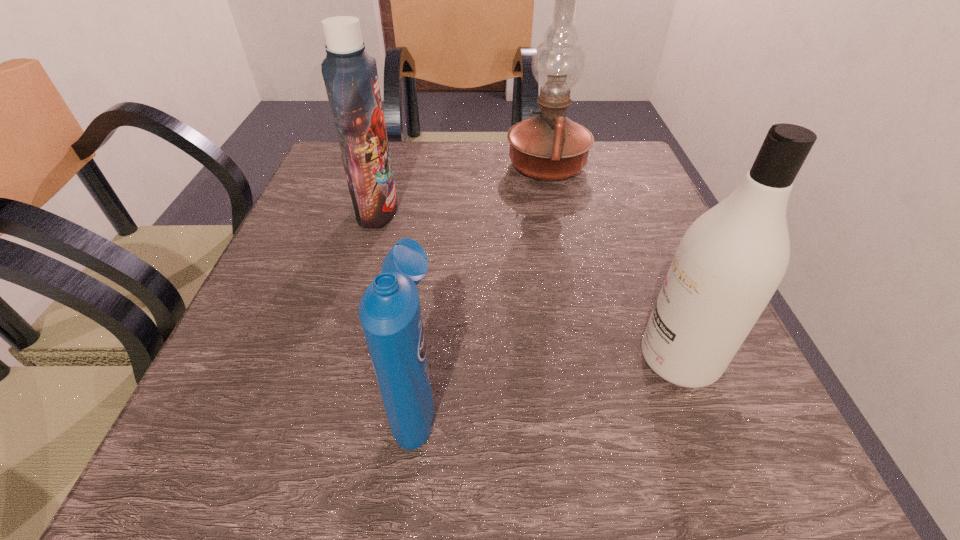
The image size is (960, 540). In order to click on free spot between the rightmost shampoo and the farthest object in this screenshot , I will do `click(612, 262)`.

Locate an element on the screen. The image size is (960, 540). free space between the rightmost shampoo and the oil lamp is located at coordinates (612, 262).

Image resolution: width=960 pixels, height=540 pixels. I want to click on vacant point located between the second object from left to right and the rightmost shampoo, so click(547, 379).

Find the location of `free point between the shortest object and the farthest object`. free point between the shortest object and the farthest object is located at coordinates (482, 282).

Select which object appears as the third closest to the farthest shampoo. Please provide its 2D coordinates. Your answer should be formatted as a tuple, i.e. [(x, y)], where the tuple contains the x and y coordinates of a point satisfying the conditions above.

[(729, 263)]

Point out which object is positioned as the nearest to the rightmost shampoo. Please provide its 2D coordinates. Your answer should be formatted as a tuple, i.e. [(x, y)], where the tuple contains the x and y coordinates of a point satisfying the conditions above.

[(390, 313)]

This screenshot has width=960, height=540. Find the location of `shampoo that can be found as the closest to the rightmost shampoo`. shampoo that can be found as the closest to the rightmost shampoo is located at coordinates [x=390, y=313].

Locate which shampoo is the second closest to the rightmost shampoo. Please provide its 2D coordinates. Your answer should be formatted as a tuple, i.e. [(x, y)], where the tuple contains the x and y coordinates of a point satisfying the conditions above.

[(350, 75)]

Where is `blank area in the image that satisfies the following two spatial constraints: 1. on the front label of the second shampoo from right to left; 2. on the left side of the leftmost shampoo`? This screenshot has height=540, width=960. blank area in the image that satisfies the following two spatial constraints: 1. on the front label of the second shampoo from right to left; 2. on the left side of the leftmost shampoo is located at coordinates (323, 399).

At what (x,y) coordinates should I click in order to perform the action: click on free space that satisfies the following two spatial constraints: 1. on the front label of the third object from right to left; 2. on the left side of the leftmost shampoo. Please return your answer as a coordinate pair (x, y). Image resolution: width=960 pixels, height=540 pixels. Looking at the image, I should click on (323, 399).